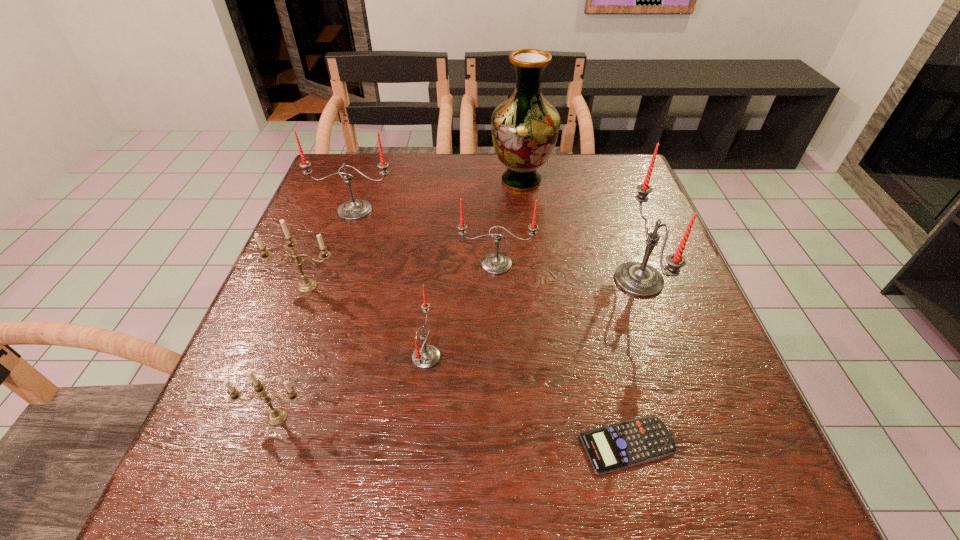
I want to click on free space located on the front-facing side of the second candle from right to left, so click(501, 381).

Identify the location of free space located 0.310m on the right of the bigger metallic candle. The width and height of the screenshot is (960, 540). (484, 286).

I want to click on vacant area located 0.320m on the front-facing side of the smallest red candle, so click(x=611, y=357).

You are a GUI agent. You are given a task and a screenshot of the screen. Output one action in this format:
    pyautogui.click(x=<x>, y=<y>)
    Task: Click on the free space located on the back of the nearest candle
    This screenshot has width=960, height=540.
    Given the screenshot: What is the action you would take?
    pyautogui.click(x=290, y=383)

Image resolution: width=960 pixels, height=540 pixels. In order to click on free space located 0.270m on the left of the blue calculator in this screenshot , I will do pyautogui.click(x=412, y=445).

Locate an element on the screen. The width and height of the screenshot is (960, 540). object that is positioned at the far edge is located at coordinates (525, 127).

The height and width of the screenshot is (540, 960). Find the location of `object situated at the near edge`. object situated at the near edge is located at coordinates (617, 446).

This screenshot has height=540, width=960. Identify the location of candle positioned at the right edge. (639, 279).

Locate an element on the screen. This screenshot has width=960, height=540. calculator present at the right edge is located at coordinates click(617, 446).

The height and width of the screenshot is (540, 960). Find the location of `object located at the near right corner`. object located at the near right corner is located at coordinates (617, 446).